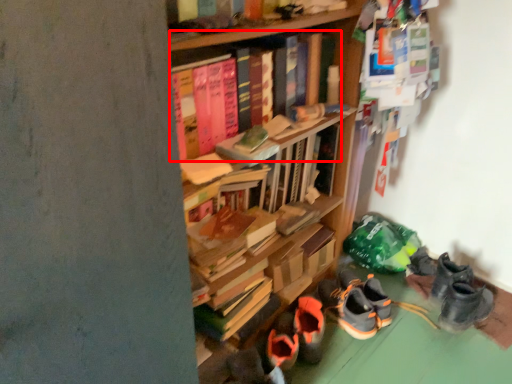
Question: From the image's perspective, what is the correct spatial relationship of book (annotated by the red box) in relation to footwear?

Choices:
 (A) below
 (B) above

Answer: (B)